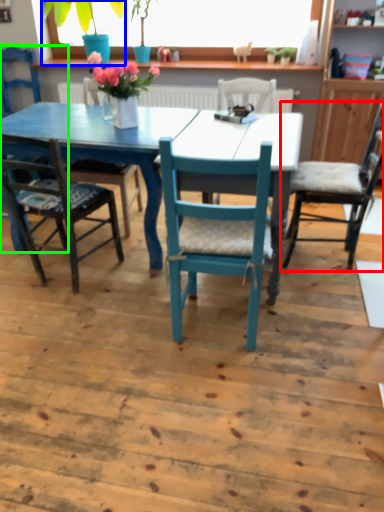
Question: Based on their relative distances, which object is farther from chair (highlighted by a red box)? Choose from houseplant (highlighted by a blue box) and chair (highlighted by a green box).

Choices:
 (A) houseplant
 (B) chair

Answer: (B)